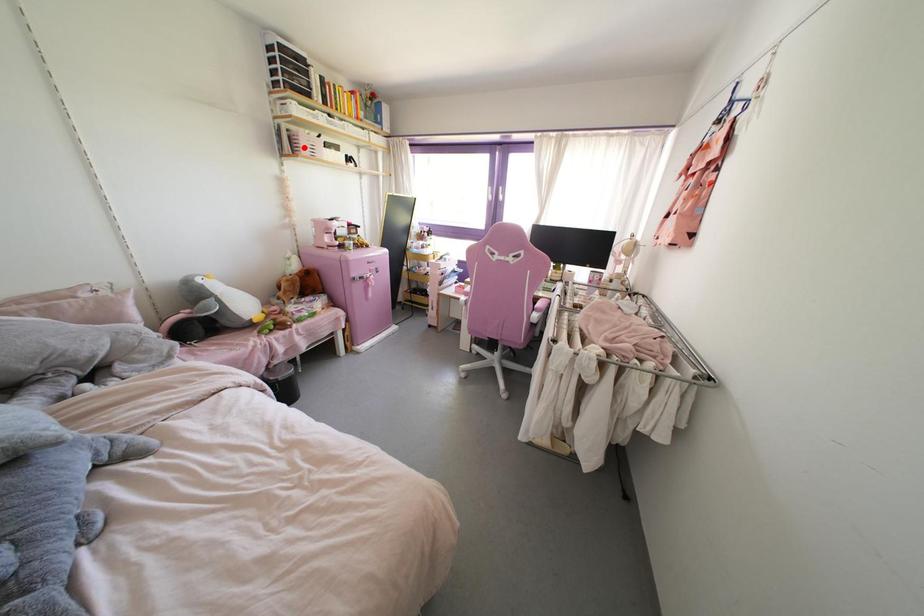
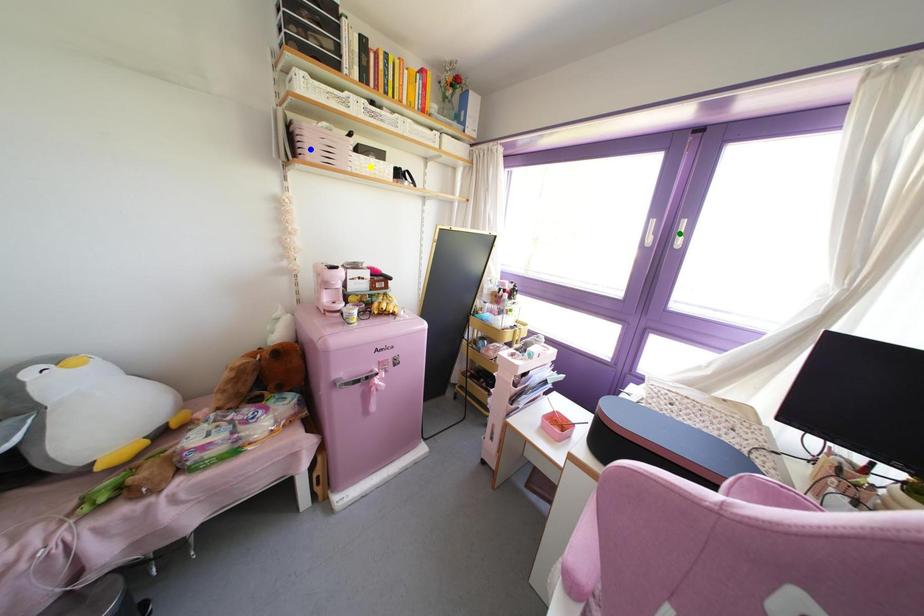
Question: I am providing you with two images of the same scene from different viewpoints. A red point is marked on the first image. You are given multiple points on the second image. In image 2, which mark is for the same physical point as the one in image 1?

Choices:
 (A) yellow point
 (B) blue point
 (C) green point

Answer: (B)